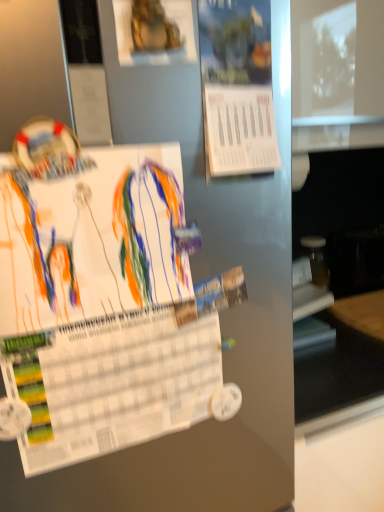
Question: Based on their positions, is white paper at center, positioned as the 3th poster in top-to-bottom order, located to the left or right of gold metallic statue at upper center, marked as the third poster in a bottom-to-top arrangement?

Choices:
 (A) left
 (B) right

Answer: (A)

Question: In terms of size, does white paper at center, the 1th poster when ordered from bottom to top, appear bigger or smaller than gold metallic statue at upper center, marked as the third poster in a bottom-to-top arrangement?

Choices:
 (A) big
 (B) small

Answer: (A)

Question: Estimate the real-world distances between objects in this image. Which object is farther from the white paper at center, positioned as the 3th poster in top-to-bottom order?

Choices:
 (A) blue paper at upper center, which appears as the 2th poster when viewed from the top
 (B) gold metallic statue at upper center, marked as the third poster in a bottom-to-top arrangement

Answer: (B)

Question: Considering the real-world distances, which object is farthest from the blue paper at upper center, which appears as the 2th poster when viewed from the top?

Choices:
 (A) gold metallic statue at upper center, the 1th poster positioned from the top
 (B) white paper at center, positioned as the 3th poster in top-to-bottom order

Answer: (B)